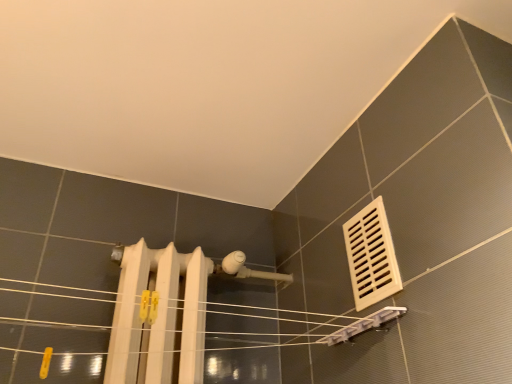
What do you see at coordinates (371, 256) in the screenshot?
I see `white matte vent at upper right` at bounding box center [371, 256].

Where is `white matte vent at upper right`? The height and width of the screenshot is (384, 512). white matte vent at upper right is located at coordinates (371, 256).

At what (x,y) coordinates should I click in order to perform the action: click on white matte vent at upper right. Please return your answer as a coordinate pair (x, y). Image resolution: width=512 pixels, height=384 pixels. Looking at the image, I should click on (371, 256).